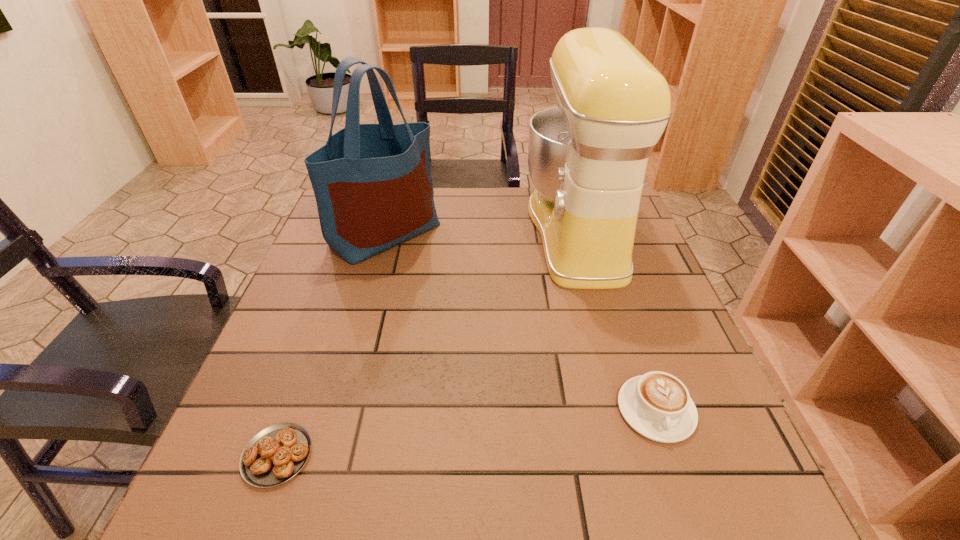
This screenshot has width=960, height=540. I want to click on vacant area that lies between the mixer and the shortest object, so click(427, 344).

You are a GUI agent. You are given a task and a screenshot of the screen. Output one action in this format:
    pyautogui.click(x=<x>, y=<y>)
    Task: Click on the free spot between the shortest object and the handbag
    Image resolution: width=960 pixels, height=540 pixels.
    Given the screenshot: What is the action you would take?
    pyautogui.click(x=331, y=344)

Locate an element on the screen. Image resolution: width=960 pixels, height=540 pixels. blank region between the mixer and the second shortest object is located at coordinates (616, 321).

The height and width of the screenshot is (540, 960). Identify the location of empty space between the mixer and the handbag. (482, 233).

Select which object appears as the closest to the pastry. Please provide its 2D coordinates. Your answer should be formatted as a tuple, i.e. [(x, y)], where the tuple contains the x and y coordinates of a point satisfying the conditions above.

[(373, 187)]

Find the location of `object that is the third closest to the shortest object`. object that is the third closest to the shortest object is located at coordinates (587, 157).